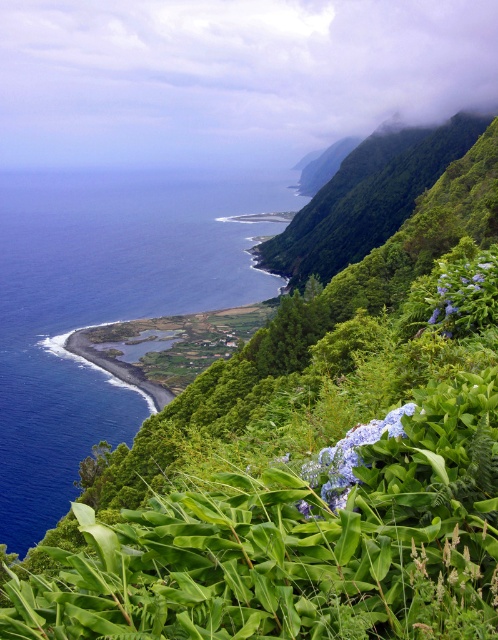
Question: Can you confirm if deep blue water at left is wider than blue matte hydrangea at center?

Choices:
 (A) no
 (B) yes

Answer: (B)

Question: Observing the image, what is the correct spatial positioning of deep blue water at left in reference to blue matte hydrangea at center?

Choices:
 (A) above
 (B) below

Answer: (A)

Question: Which object appears farthest from the camera in this image?

Choices:
 (A) deep blue water at left
 (B) blue matte hydrangea at center

Answer: (A)

Question: Can you confirm if deep blue water at left is smaller than purple matte hydrangea at right?

Choices:
 (A) no
 (B) yes

Answer: (A)

Question: Based on their relative distances, which object is nearer to the blue matte hydrangea at center?

Choices:
 (A) deep blue water at left
 (B) purple matte hydrangea at right

Answer: (B)

Question: Among these points, which one is nearest to the camera?

Choices:
 (A) (374, 428)
 (B) (38, 449)

Answer: (A)